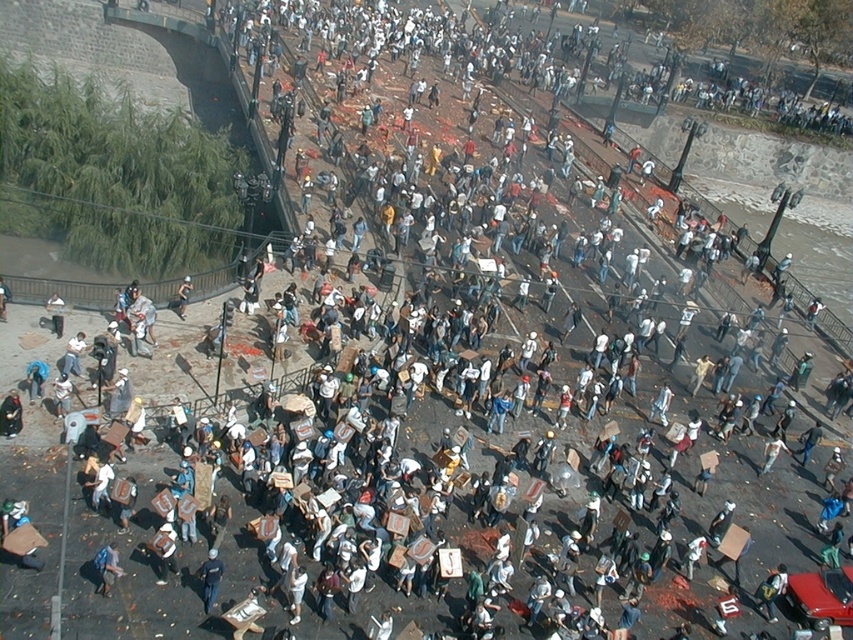
How much distance is there between blue denim jeans at lower left and light blue denim jeans at lower left?

blue denim jeans at lower left and light blue denim jeans at lower left are 14.73 meters apart from each other.

Which is in front, point (109, 572) or point (178, 300)?

Point (109, 572) is more forward.

At what (x,y) coordinates should I click in order to perform the action: click on blue denim jeans at lower left. Please return your answer as a coordinate pair (x, y). This screenshot has height=640, width=853. Looking at the image, I should click on (107, 566).

Is point (212, 554) farther from camera compared to point (177, 304)?

No.

Does dark blue uniform at center appear under light blue denim jeans at lower left?

Indeed, dark blue uniform at center is positioned under light blue denim jeans at lower left.

This screenshot has height=640, width=853. In order to click on dark blue uniform at center in this screenshot , I will do `click(210, 579)`.

Does point (207, 577) come behind point (107, 588)?

Yes, point (207, 577) is behind point (107, 588).

Is point (201, 577) positioned in front of point (113, 556)?

No, it is not.

Identify the location of dark blue uniform at center. The height and width of the screenshot is (640, 853). (210, 579).